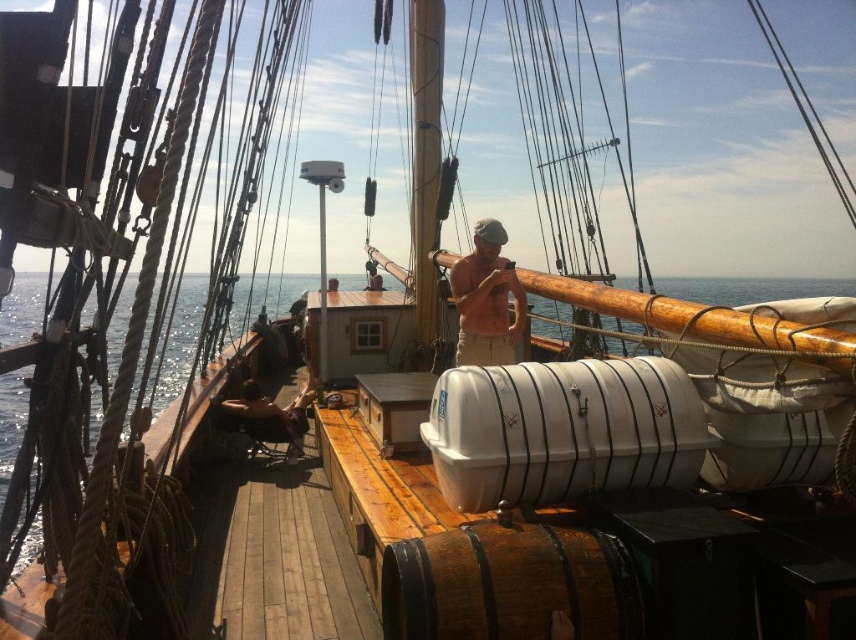
Question: Among these objects, which one is farthest from the camera?

Choices:
 (A) smooth brown hair at lower left
 (B) tan cotton shirt at center

Answer: (A)

Question: Observing the image, what is the correct spatial positioning of tan cotton shirt at center in reference to smooth brown hair at lower left?

Choices:
 (A) left
 (B) right

Answer: (B)

Question: Among these points, which one is nearest to the camera?

Choices:
 (A) (270, 419)
 (B) (498, 241)

Answer: (B)

Question: Among these objects, which one is nearest to the camera?

Choices:
 (A) smooth brown hair at lower left
 (B) tan cotton shirt at center

Answer: (B)

Question: Is tan cotton shirt at center in front of smooth brown hair at lower left?

Choices:
 (A) yes
 (B) no

Answer: (A)

Question: Can you confirm if tan cotton shirt at center is positioned above smooth brown hair at lower left?

Choices:
 (A) yes
 (B) no

Answer: (A)